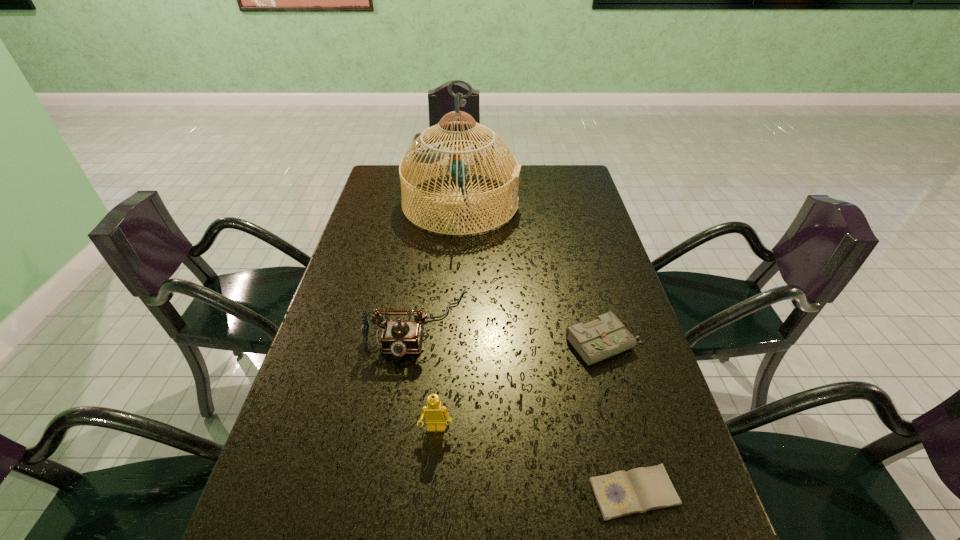
Image resolution: width=960 pixels, height=540 pixels. Find the location of `vacant region located 0.150m on the face of the second nearest object`. vacant region located 0.150m on the face of the second nearest object is located at coordinates (429, 514).

Locate an element on the screen. vacant position located 0.140m on the left of the farther diary is located at coordinates (510, 343).

Locate an element on the screen. free space located on the left of the nearer diary is located at coordinates (511, 492).

The width and height of the screenshot is (960, 540). What are the coordinates of `object located in the far edge section of the desktop` in the screenshot? It's located at (434, 152).

Where is `birdcage that is positioned at the left edge`? birdcage that is positioned at the left edge is located at coordinates (434, 152).

Where is `telephone that is at the left edge`? telephone that is at the left edge is located at coordinates (399, 337).

This screenshot has width=960, height=540. In order to click on object present at the far left corner in this screenshot , I will do [434, 152].

The image size is (960, 540). I want to click on vacant space at the far edge, so click(534, 176).

You are a GUI agent. You are given a task and a screenshot of the screen. Output one action in this format:
    pyautogui.click(x=<x>, y=<y>)
    Task: Click on the vacant space at the left edge
    The height and width of the screenshot is (540, 960).
    Given the screenshot: What is the action you would take?
    pyautogui.click(x=335, y=303)

In the image, there is a desktop. What are the coordinates of `vacant space at the right edge` in the screenshot? It's located at (572, 285).